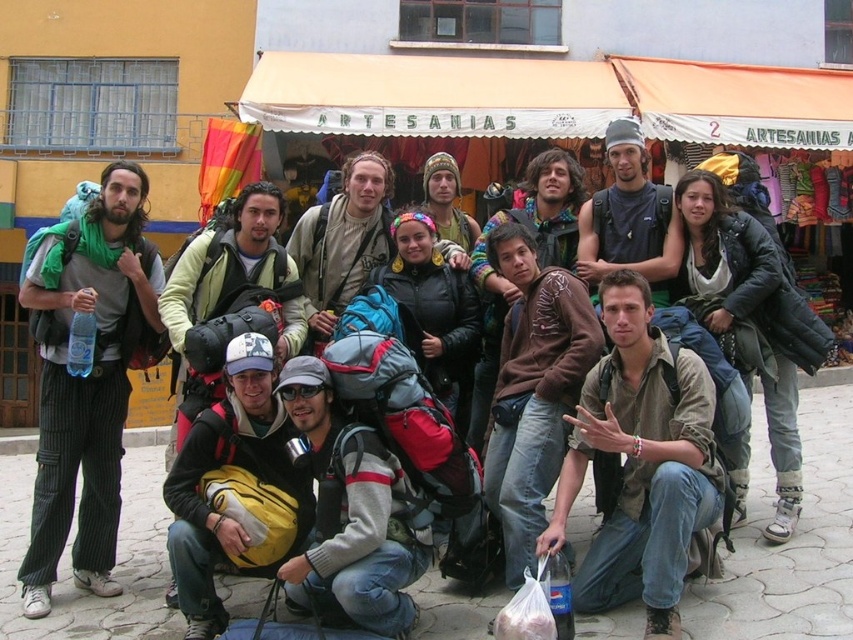
You are a photographer trying to capture the orange fabric canopy at upper center and the yellow backpack at lower center in the same frame. Which object is located to the right of the other?

The orange fabric canopy at upper center is positioned on the right side of yellow backpack at lower center.

You are a photographer trying to capture a clear shot of the gray fleece jacket at center. However, the brown textured shirt at center is blocking your view. Based on the scene description, can you adjust your position to see the jacket?

The brown textured shirt at center is in front of the gray fleece jacket at center, so moving your camera angle slightly backward or to the side might allow you to see around the shirt and capture the jacket.

You are a photographer trying to capture a group photo of the travelers in front of the market stall. You notice the green striped pants at left and the yellow backpack at lower center. Which object is located more to the left side of the photo?

The green striped pants at left is positioned on the left side of the yellow backpack at lower center, so it is more to the left in the photo.